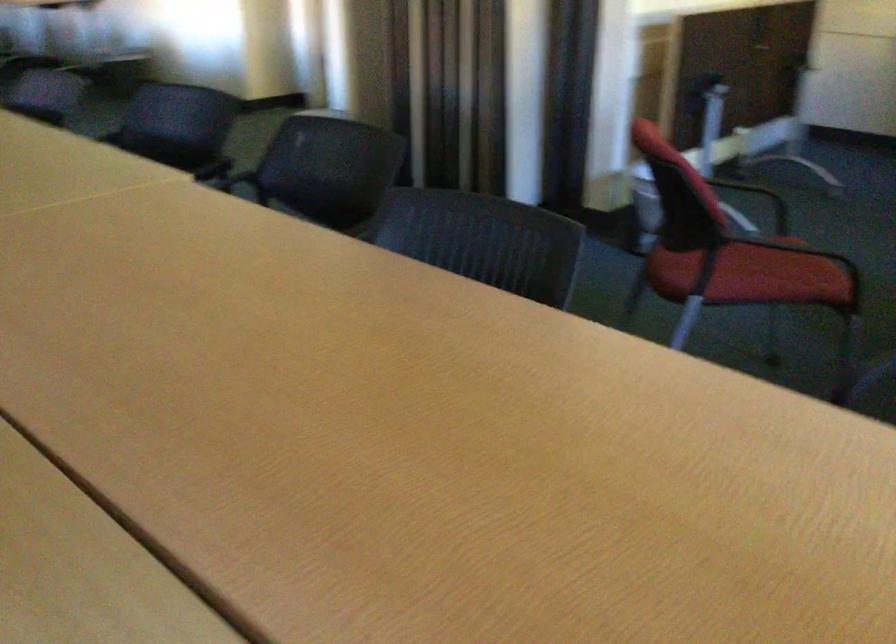
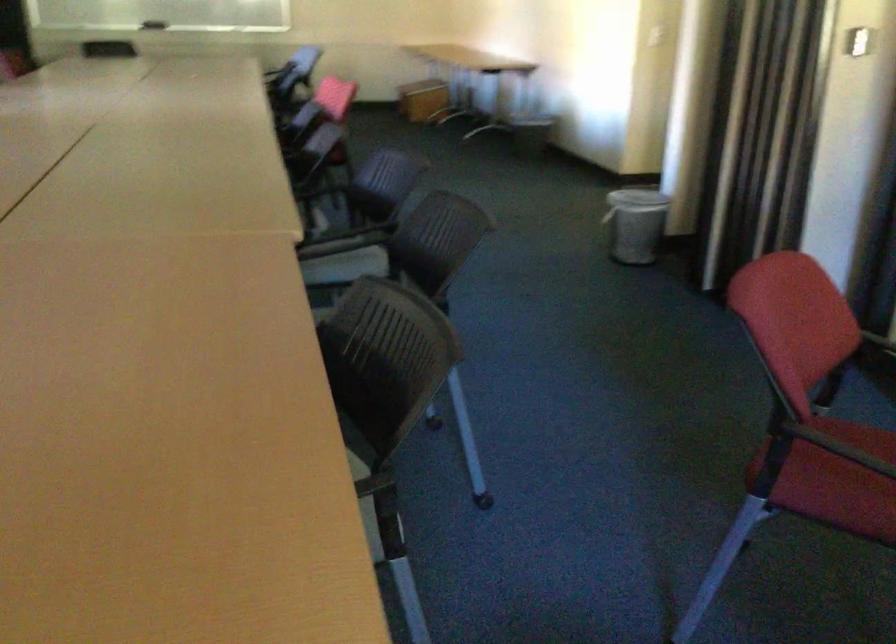
Question: The camera is either moving clockwise (left) or counter-clockwise (right) around the object. The first image is from the beginning of the video and the second image is from the end. Is the camera moving left or right when shooting the video?

Choices:
 (A) Left
 (B) Right

Answer: (B)